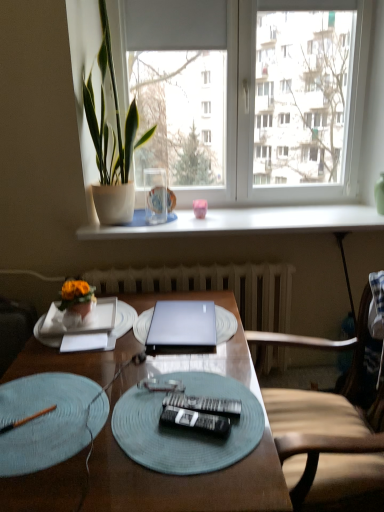
Locate an element on the screen. The image size is (384, 512). free region on the left part of black plastic remote control at center, which is counted as the first remote control, starting from the back is located at coordinates (132, 411).